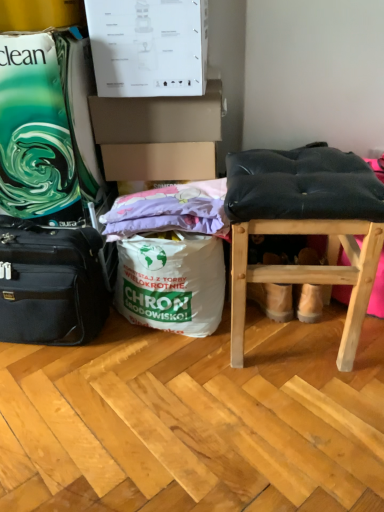
Question: Can purple fabric at center be found inside black leather stool at right?

Choices:
 (A) no
 (B) yes

Answer: (A)

Question: Does black leather stool at right have a lesser height compared to purple fabric at center?

Choices:
 (A) no
 (B) yes

Answer: (A)

Question: Does black leather stool at right have a greater width compared to purple fabric at center?

Choices:
 (A) no
 (B) yes

Answer: (B)

Question: From a real-world perspective, is black leather stool at right positioned over purple fabric at center based on gravity?

Choices:
 (A) yes
 (B) no

Answer: (B)

Question: Does black leather stool at right have a lesser width compared to purple fabric at center?

Choices:
 (A) no
 (B) yes

Answer: (A)

Question: Does black leather stool at right have a greater height compared to purple fabric at center?

Choices:
 (A) yes
 (B) no

Answer: (A)

Question: From the image's perspective, would you say purple fabric at center is shown under black leather stool at right?

Choices:
 (A) no
 (B) yes

Answer: (A)

Question: Is the position of purple fabric at center less distant than that of black leather stool at right?

Choices:
 (A) yes
 (B) no

Answer: (B)

Question: Considering the relative sizes of purple fabric at center and black leather stool at right in the image provided, is purple fabric at center wider than black leather stool at right?

Choices:
 (A) yes
 (B) no

Answer: (B)

Question: Is purple fabric at center surrounding black leather stool at right?

Choices:
 (A) no
 (B) yes

Answer: (A)

Question: Can you confirm if purple fabric at center is taller than black leather stool at right?

Choices:
 (A) no
 (B) yes

Answer: (A)

Question: Does purple fabric at center come behind black leather stool at right?

Choices:
 (A) no
 (B) yes

Answer: (B)

Question: Can you confirm if purple fabric at center is bigger than black fabric suitcase at left?

Choices:
 (A) no
 (B) yes

Answer: (A)